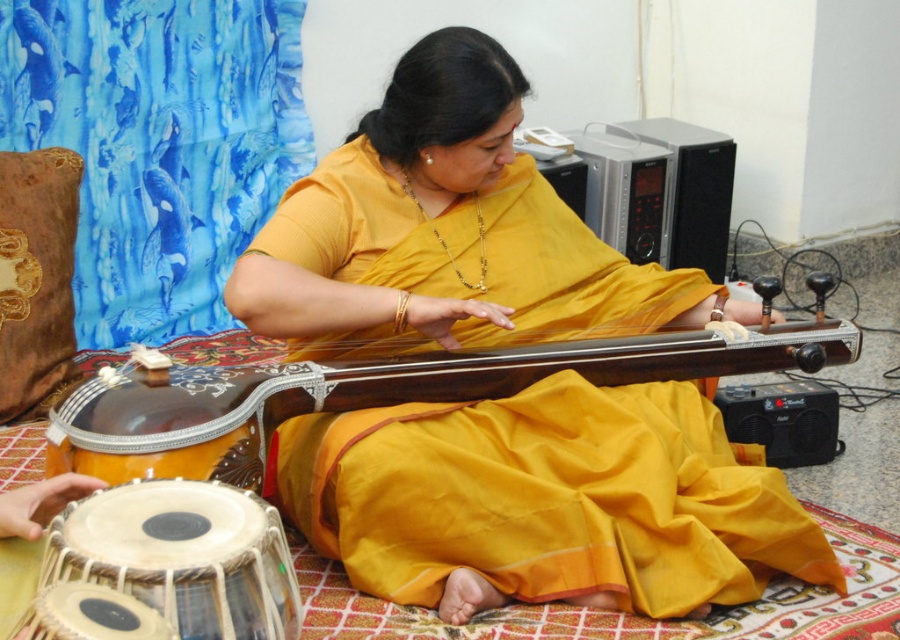
Between white leather drum at lower left and matte silver drum at lower left, which one has less height?

matte silver drum at lower left

Is white leather drum at lower left bigger than matte silver drum at lower left?

Yes, white leather drum at lower left is bigger than matte silver drum at lower left.

Is point (177, 582) in front of point (88, 632)?

No.

Find the location of a particular element. white leather drum at lower left is located at coordinates tap(182, 556).

Is matte yellow sari at center in front of wooden/silver inlay sitar at center?

No, matte yellow sari at center is further to the viewer.

Between point (453, 216) and point (343, 392), which one is positioned behind?

The point (453, 216) is behind.

Image resolution: width=900 pixels, height=640 pixels. In order to click on matte yellow sari at center in this screenshot , I will do `click(547, 500)`.

At what (x,y) coordinates should I click in order to perform the action: click on wooden/silver inlay sitar at center. Please return your answer as a coordinate pair (x, y). The image size is (900, 640). Looking at the image, I should click on (375, 392).

Measure the distance from wooden/silver inlay sitar at center to white leather drum at lower left.

wooden/silver inlay sitar at center is 15.26 inches from white leather drum at lower left.

Between point (792, 355) and point (144, 500), which one is positioned behind?

Point (792, 355)

The height and width of the screenshot is (640, 900). What are the coordinates of `wooden/silver inlay sitar at center` in the screenshot? It's located at (375, 392).